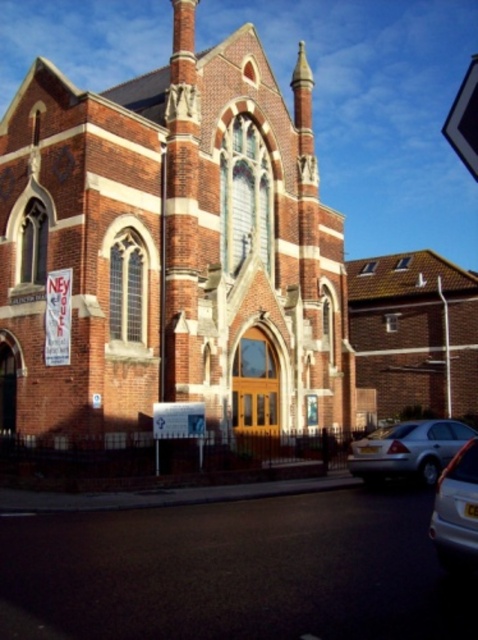
Question: Does brick church at center have a lesser width compared to silver metallic sedan at lower right?

Choices:
 (A) no
 (B) yes

Answer: (A)

Question: Is the position of silver metallic sedan at lower right more distant than that of metallic silver car at lower right?

Choices:
 (A) no
 (B) yes

Answer: (B)

Question: Which of these objects is positioned closest to the metallic silver car at lower right?

Choices:
 (A) silver metallic sedan at lower right
 (B) brick church at center

Answer: (A)

Question: Which of these objects is positioned closest to the metallic silver car at lower right?

Choices:
 (A) silver metallic sedan at lower right
 (B) brick church at center

Answer: (A)

Question: Is brick church at center to the left of silver metallic sedan at lower right from the viewer's perspective?

Choices:
 (A) yes
 (B) no

Answer: (A)

Question: Among these points, which one is farthest from the camera?

Choices:
 (A) tap(436, 458)
 (B) tap(443, 493)
 (C) tap(220, 339)

Answer: (C)